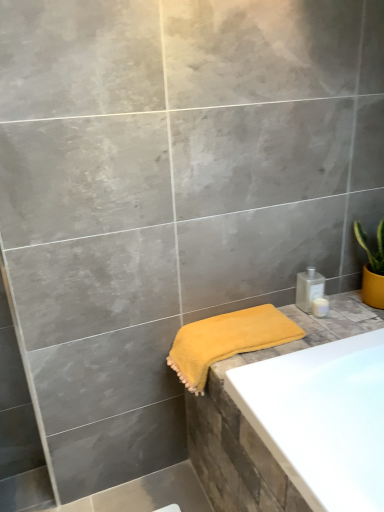
Question: From a real-world perspective, is white glossy soap dispenser at upper right, the first toiletry when ordered from bottom to top, above or below yellow soft towel at lower right?

Choices:
 (A) below
 (B) above

Answer: (B)

Question: Is white glossy soap dispenser at upper right, the first toiletry when ordered from bottom to top, situated inside yellow soft towel at lower right or outside?

Choices:
 (A) inside
 (B) outside

Answer: (B)

Question: Which is farther from the satin silver bottle at right, the 2th toiletry when ordered from bottom to top?

Choices:
 (A) white glossy soap dispenser at upper right, the second toiletry positioned from the top
 (B) yellow soft towel at lower right

Answer: (B)

Question: Which is nearer to the yellow soft towel at lower right?

Choices:
 (A) satin silver bottle at right, the first toiletry in the top-to-bottom sequence
 (B) white glossy soap dispenser at upper right, the first toiletry when ordered from bottom to top

Answer: (A)